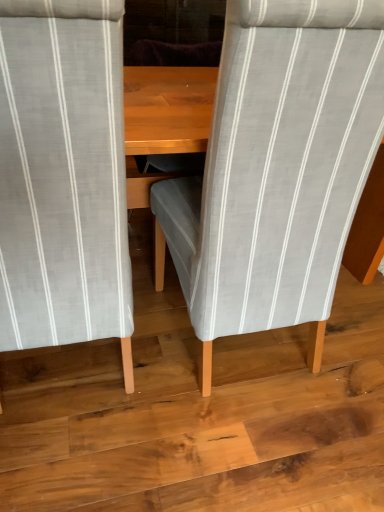
Question: Looking at their shapes, would you say light gray striped fabric chair at center, the first chair positioned from the right, is wider or thinner than wooden floor at center?

Choices:
 (A) wide
 (B) thin

Answer: (B)

Question: Looking at the image, does light gray striped fabric chair at center, placed as the 2th chair when sorted from left to right, seem bigger or smaller compared to wooden floor at center?

Choices:
 (A) small
 (B) big

Answer: (B)

Question: Estimate the real-world distances between objects in this image. Which object is farther from the light gray striped fabric chair at center, placed as the 2th chair when sorted from left to right?

Choices:
 (A) wooden floor at center
 (B) light gray striped fabric chair at center, which is the first chair in left-to-right order

Answer: (A)

Question: Estimate the real-world distances between objects in this image. Which object is closer to the wooden floor at center?

Choices:
 (A) light gray striped fabric chair at center, the second chair when ordered from right to left
 (B) light gray striped fabric chair at center, the first chair positioned from the right

Answer: (B)